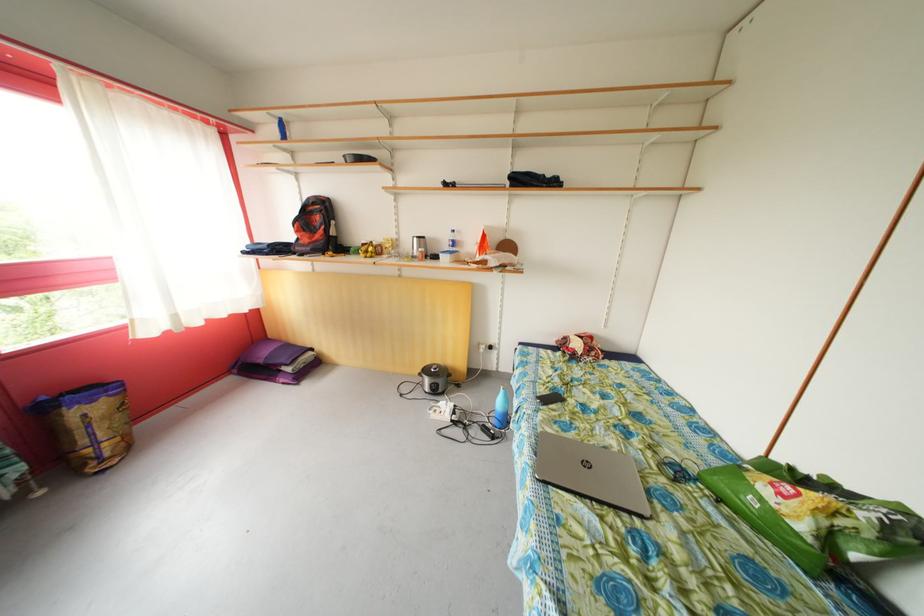
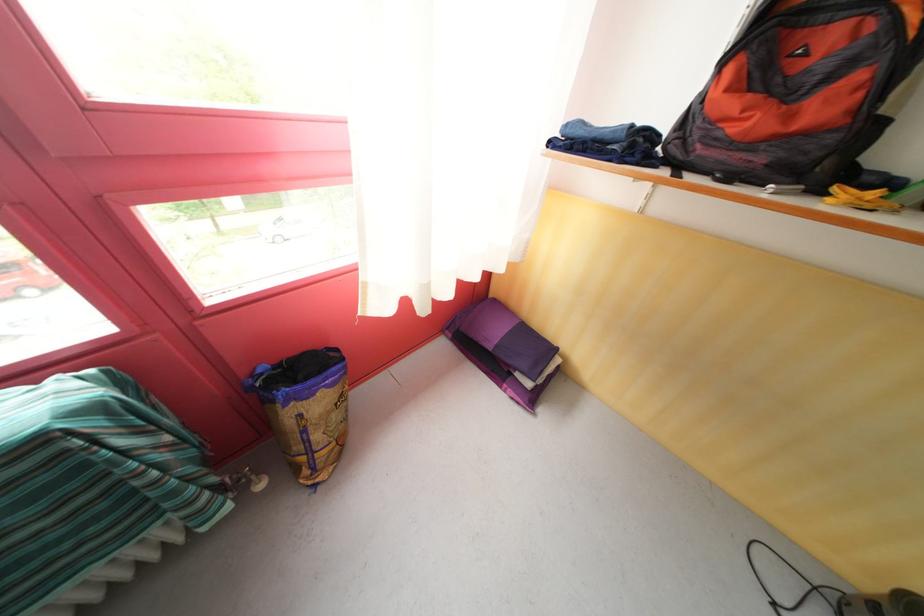
Where in the second image is the point corresponding to pixel 91 448 from the first image?

(305, 454)